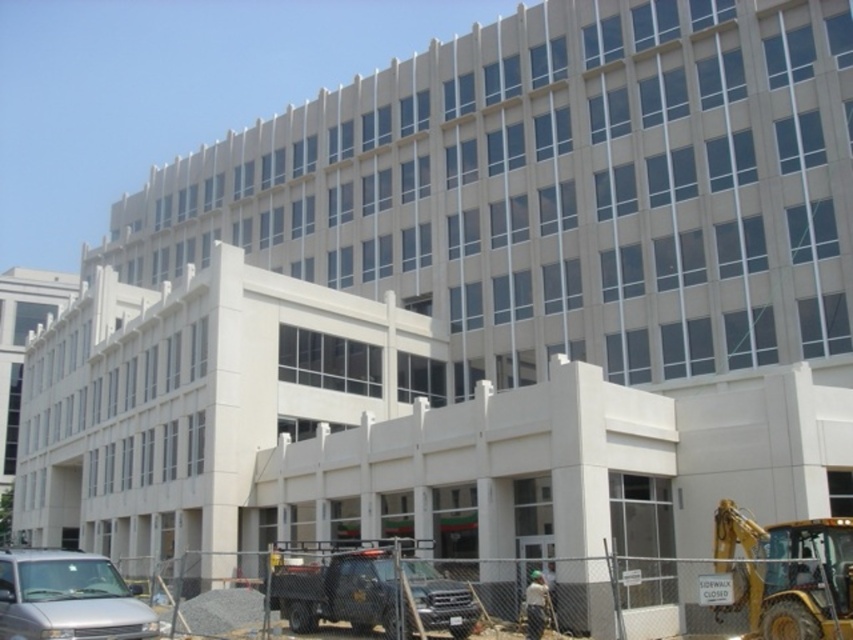
Question: Which object is closer to the camera taking this photo?

Choices:
 (A) yellow metallic excavator at lower right
 (B) green fabric construction worker at lower right
 (C) matte black truck at lower center

Answer: (A)

Question: Is yellow metallic excavator at lower right wider than silver metallic van at lower left?

Choices:
 (A) no
 (B) yes

Answer: (A)

Question: Which object is the closest to the silver metallic van at lower left?

Choices:
 (A) yellow metallic excavator at lower right
 (B) green fabric construction worker at lower right

Answer: (B)

Question: Does silver metallic van at lower left appear on the right side of green fabric construction worker at lower right?

Choices:
 (A) yes
 (B) no

Answer: (B)

Question: Is yellow metallic excavator at lower right above green fabric construction worker at lower right?

Choices:
 (A) yes
 (B) no

Answer: (A)

Question: Estimate the real-world distances between objects in this image. Which object is closer to the silver metallic van at lower left?

Choices:
 (A) green fabric construction worker at lower right
 (B) matte black truck at lower center
 (C) yellow metallic excavator at lower right

Answer: (B)